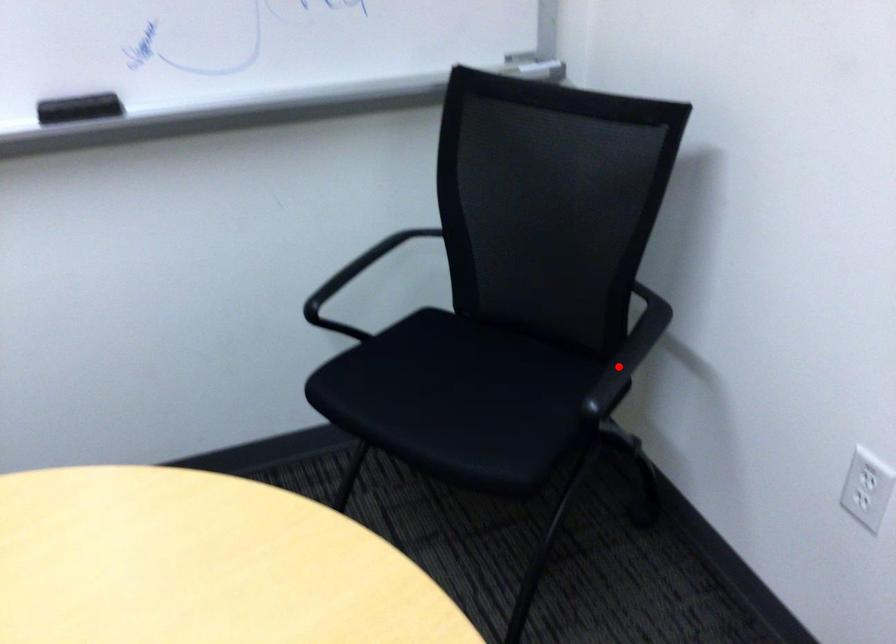
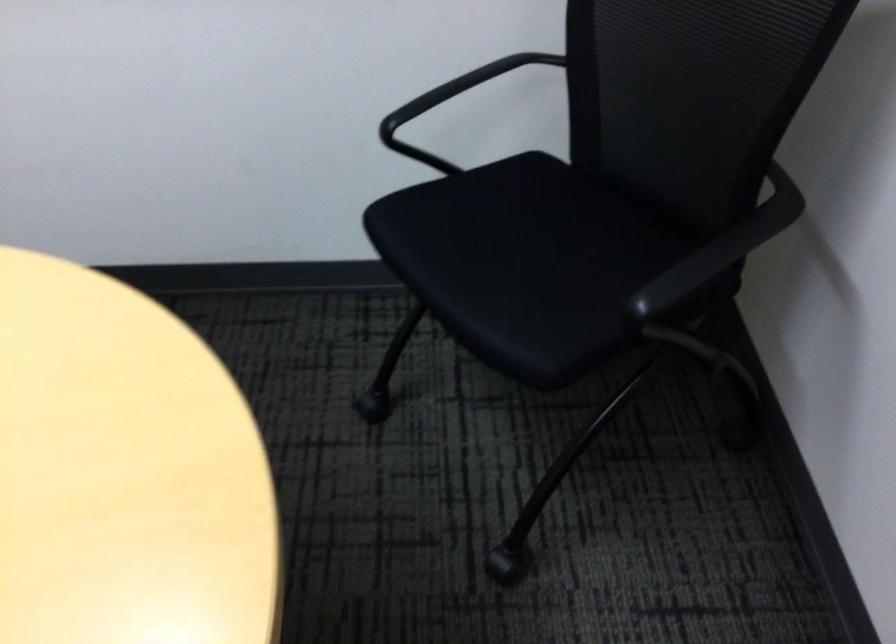
In the second image, find the point that corresponds to the highlighted location in the first image.

(702, 268)